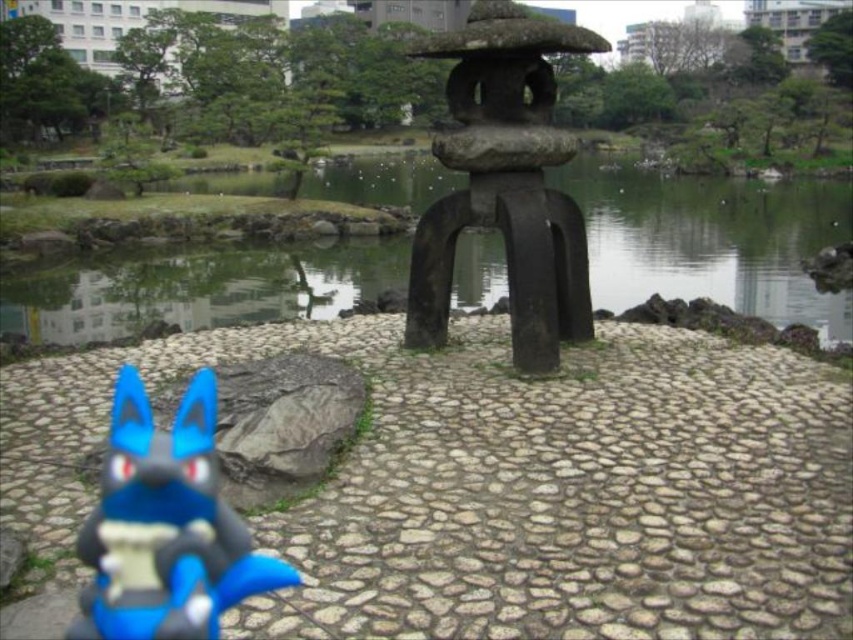
In the scene shown: Is green stone lake at center positioned in front of dark gray stone lantern at center?

No, it is behind dark gray stone lantern at center.

Between point (665, 214) and point (444, 132), which one is positioned in front?

Point (444, 132)

Locate an element on the screen. The image size is (853, 640). green stone lake at center is located at coordinates (708, 240).

Locate an element on the screen. green stone lake at center is located at coordinates (708, 240).

Is green stone lake at center above blue matte plush toy at lower left?

Correct, green stone lake at center is located above blue matte plush toy at lower left.

What are the coordinates of `green stone lake at center` in the screenshot? It's located at (708, 240).

Measure the distance between green stone lake at center and camera.

A distance of 14.86 feet exists between green stone lake at center and camera.

Identify the location of green stone lake at center. (708, 240).

Measure the distance from dark gray stone lantern at center to blue matte plush toy at lower left.

They are 3.31 meters apart.

From the picture: Between dark gray stone lantern at center and blue matte plush toy at lower left, which one appears on the right side from the viewer's perspective?

dark gray stone lantern at center is more to the right.

What do you see at coordinates (505, 182) in the screenshot? The height and width of the screenshot is (640, 853). I see `dark gray stone lantern at center` at bounding box center [505, 182].

At what (x,y) coordinates should I click in order to perform the action: click on dark gray stone lantern at center. Please return your answer as a coordinate pair (x, y). The width and height of the screenshot is (853, 640). Looking at the image, I should click on (505, 182).